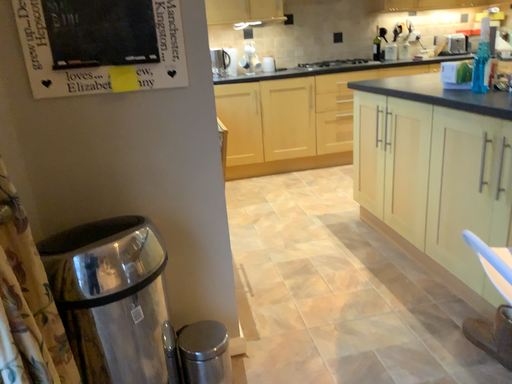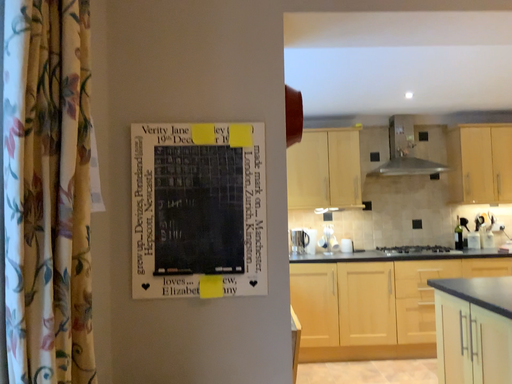
Question: How did the camera likely rotate when shooting the video?

Choices:
 (A) rotated left
 (B) rotated right

Answer: (A)